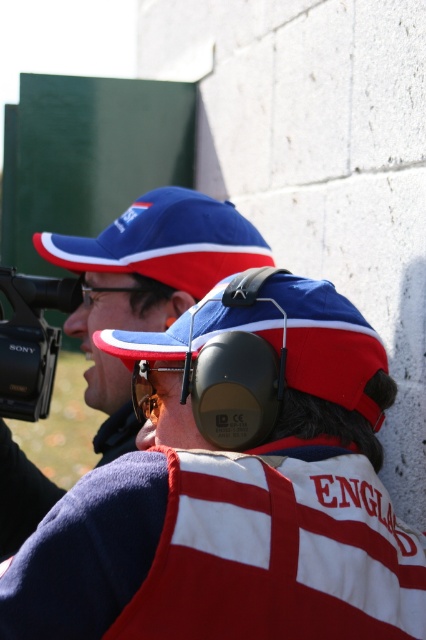
Question: Does matte blue cap at upper center appear on the left side of black plastic camera at left?

Choices:
 (A) yes
 (B) no

Answer: (B)

Question: Among these points, which one is farthest from the camera?

Choices:
 (A) [137, 413]
 (B) [16, 364]

Answer: (B)

Question: From the image, what is the correct spatial relationship of matte blue cap at upper center in relation to matte blue baseball cap at center?

Choices:
 (A) below
 (B) above

Answer: (A)

Question: Which point is farther from the camera taking this photo?

Choices:
 (A) (68, 289)
 (B) (157, 401)
 (C) (350, 404)
 (D) (3, 528)

Answer: (D)

Question: Which point is farther to the camera?

Choices:
 (A) blue fabric baseball cap at upper center
 (B) matte black goggles at center
 (C) matte blue cap at upper center

Answer: (A)

Question: Does matte blue cap at upper center appear over blue fabric baseball cap at upper center?

Choices:
 (A) yes
 (B) no

Answer: (B)